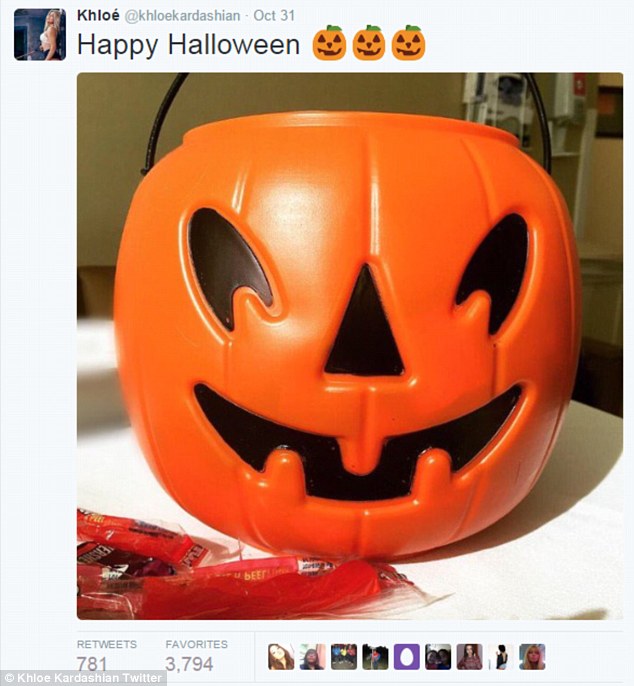
Find the location of a particular element. The width and height of the screenshot is (634, 686). orange plastic pumpkin is located at coordinates (309, 220).